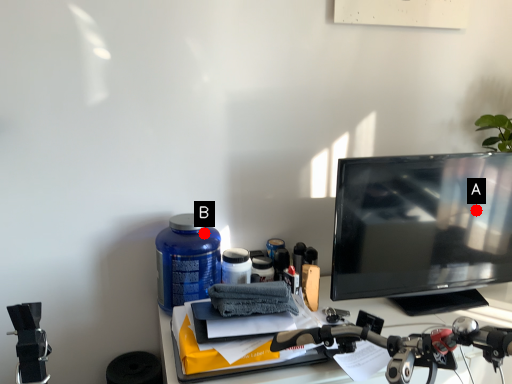
Question: Two points are circled on the image, labeled by A and B beside each circle. Which point is farther to the camera?

Choices:
 (A) A is further
 (B) B is further

Answer: (A)